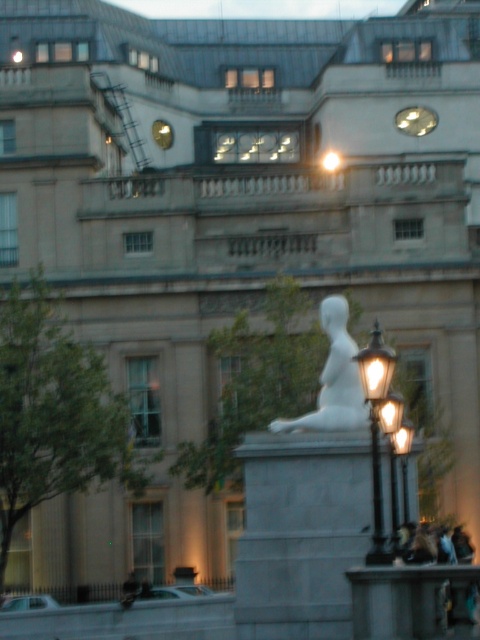
Which is below, white marble statue at center or polished brass streetlight at center-right?

polished brass streetlight at center-right

Measure the distance between white marble statue at center and polished brass streetlight at center-right.

white marble statue at center is 15.46 feet away from polished brass streetlight at center-right.

Image resolution: width=480 pixels, height=640 pixels. Describe the element at coordinates (334, 380) in the screenshot. I see `white marble statue at center` at that location.

This screenshot has width=480, height=640. In order to click on white marble statue at center in this screenshot , I will do `click(334, 380)`.